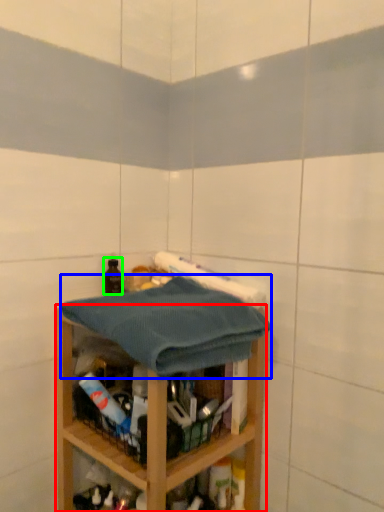
Question: Which object is positioned closest to shelf (highlighted by a red box)? Select from bath towel (highlighted by a blue box) and bottle (highlighted by a green box).

Choices:
 (A) bath towel
 (B) bottle

Answer: (A)